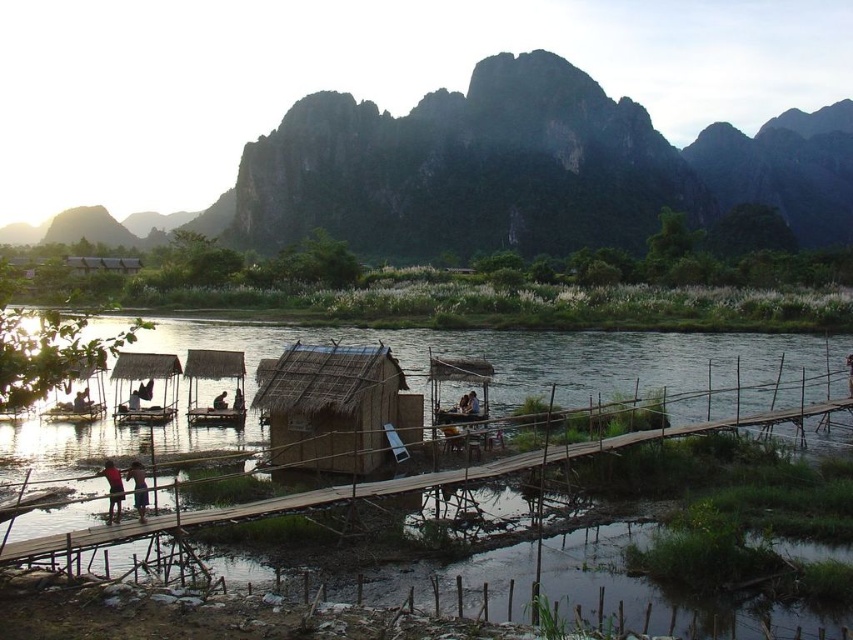
Locate an element on the screen. This screenshot has width=853, height=640. thatched bamboo hut at center is located at coordinates (144, 387).

Does brown thatch hut at center come behind dark brown wooden boat at center?

No, it is not.

Can you confirm if brown thatch hut at center is thinner than dark brown wooden boat at center?

Incorrect, brown thatch hut at center's width is not less than dark brown wooden boat at center's.

I want to click on brown thatch hut at center, so click(335, 406).

Find the location of a particular element. brown thatch hut at center is located at coordinates (335, 406).

Which is more to the left, wooden bridge at center or thatched bamboo hut at center?

Positioned to the left is thatched bamboo hut at center.

Is point (148, 528) closer to camera compared to point (175, 360)?

Yes, point (148, 528) is closer to viewer.

You are a GUI agent. You are given a task and a screenshot of the screen. Output one action in this format:
    pyautogui.click(x=<x>, y=<y>)
    Task: Click on the wooden bridge at center
    
    Given the screenshot: What is the action you would take?
    pyautogui.click(x=392, y=483)